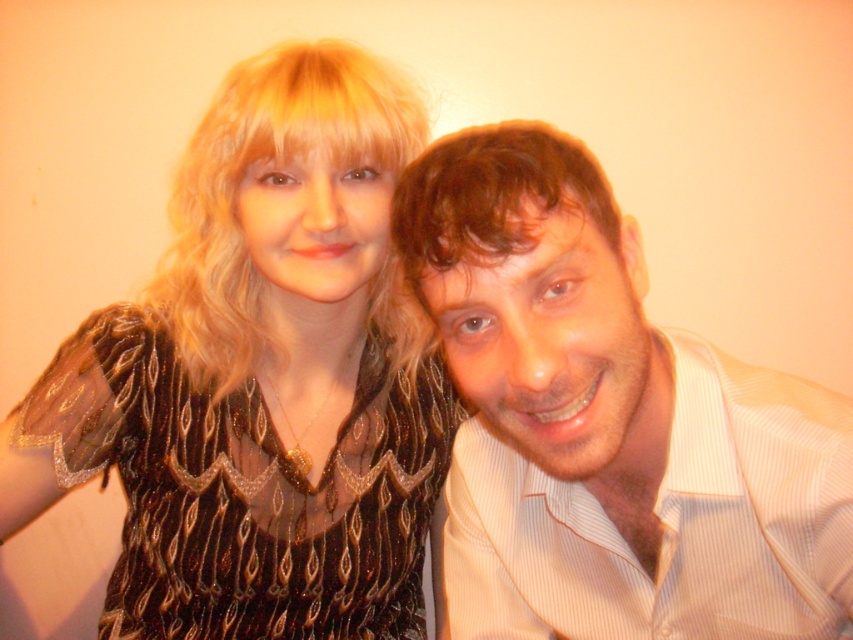
Based on the scene description, can you determine which clothing item is positioned to the right of the other between the light brown striped shirt at center and the black sequined dress at center?

The light brown striped shirt at center is positioned to the right of the black sequined dress at center.

You are a photographer trying to capture a group photo of the light brown striped shirt at center and the black sequined dress at center. To ensure both subjects are in focus, you need to adjust the camera settings based on their sizes. Which subject requires a closer focus distance due to its smaller size?

The light brown striped shirt at center has a smaller size compared to the black sequined dress at center, so the photographer should focus closer on the light brown striped shirt at center to ensure it is in focus.

You are a photographer taking a portrait of two people. You need to ensure that the light brown striped shirt at center is visible in the final shot. Given that the black sequined dress at center is behind it, where should you position your camera relative to the subjects?

Position your camera so that it faces the light brown striped shirt at center, ensuring it is in front of the black sequined dress at center. This way, the shirt will be clearly visible without being obscured by the dress.